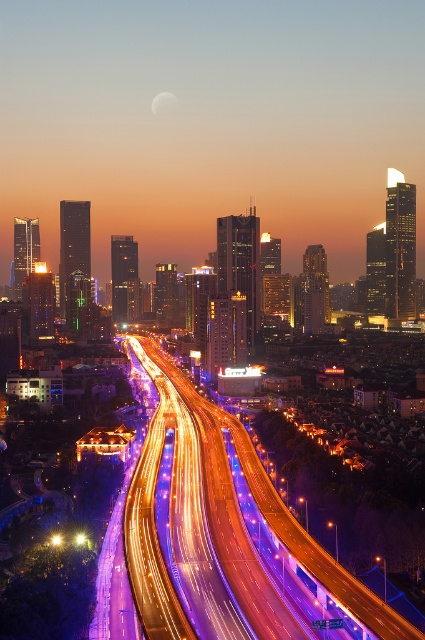
You are a drone operator planning to fly a drone from the purple light trails at center to the silvery reflective moon at upper center. Given that the drone has a maximum range of 300 meters, can it successfully reach the moon?

The purple light trails at center is 284.52 meters away from the silvery reflective moon at upper center. Since the distance is within the drone operator drone has a maximum range of 300 meters, the drone can successfully reach the silvery reflective moon at upper center.

You are an astronomer observing the city from a high vantage point. You notice the purple light trails at center and the silvery reflective moon at upper center. Which object appears higher in the sky?

The purple light trails at center appear higher in the sky than the silvery reflective moon at upper center because the description states that the purple light trails at center is taller than the silvery reflective moon at upper center.

You are an astronomer observing the city from a distance. You notice the purple light trails at center and the silvery reflective moon at upper center. Which object appears closer to you in the image?

The purple light trails at center appear closer to you because they are positioned nearer in the scene compared to the silvery reflective moon at upper center.